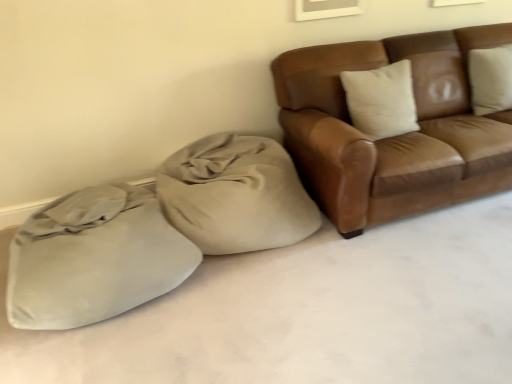
Question: Is point (239, 200) closer or farther from the camera than point (456, 195)?

Choices:
 (A) closer
 (B) farther

Answer: (A)

Question: Considering the positions of beige fabric bean bag at center and brown leather couch at upper right in the image, is beige fabric bean bag at center taller or shorter than brown leather couch at upper right?

Choices:
 (A) short
 (B) tall

Answer: (A)

Question: Which object is the farthest from the suede-like beige sack at lower left?

Choices:
 (A) brown leather couch at upper right
 (B) beige fabric bean bag at center

Answer: (A)

Question: Which is nearer to the brown leather couch at upper right?

Choices:
 (A) beige fabric bean bag at center
 (B) suede-like beige sack at lower left

Answer: (A)